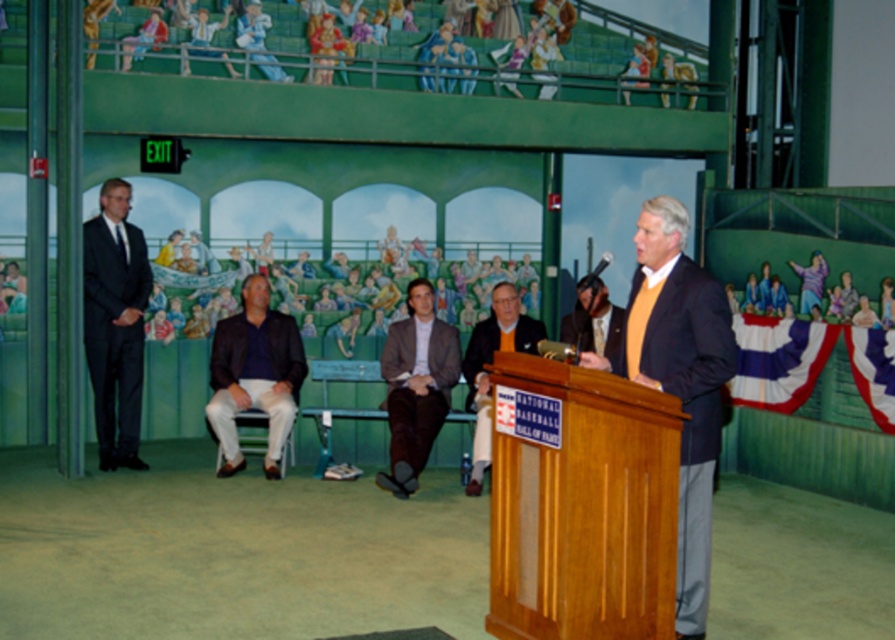
You are a photographer at the event and need to capture a photo of both the dark blue shirt at center and the brown suede jacket at center. Based on their positions, which one is more likely to be fully visible in the photo if you frame the shot to include the center area?

The dark blue shirt at center is wider than the brown suede jacket at center, so it might be more likely to be fully visible in the photo if framed to include the center area.

You are standing in the front row of the audience. You want to hand a gift to the person wearing the orange sweater at center and the person wearing the matte black suit at center. Which one can you reach without moving from your current position?

The orange sweater at center is closer to the viewer than the matte black suit at center, so you can reach the person wearing the orange sweater at center without moving, but you cannot reach the person wearing the matte black suit at center from your current position.

You are attending the event and want to know the exact location of the dark gray suit at left. Can you describe its position relative to the podium?

The dark gray suit at left is located at point coordinates 0.505 on the x and 0.130 on the y axis relative to the podium.